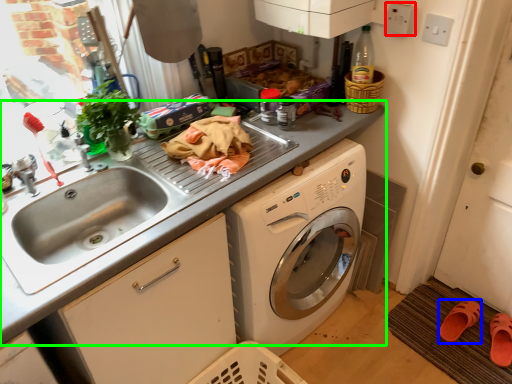
Question: Based on their relative distances, which object is nearer to electric outlet (highlighted by a red box)? Choose from shoe (highlighted by a blue box) and countertop (highlighted by a green box).

Choices:
 (A) shoe
 (B) countertop

Answer: (B)